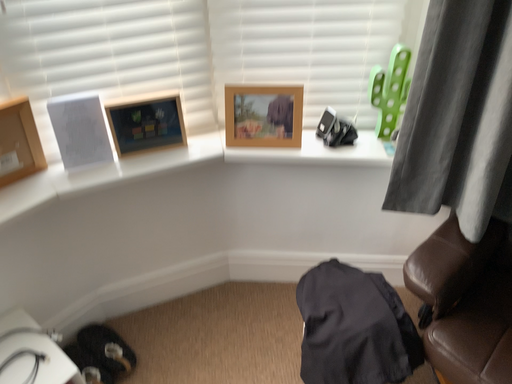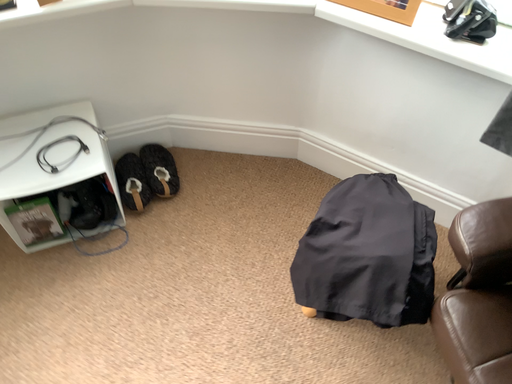
Question: How did the camera likely rotate when shooting the video?

Choices:
 (A) rotated upward
 (B) rotated downward

Answer: (B)